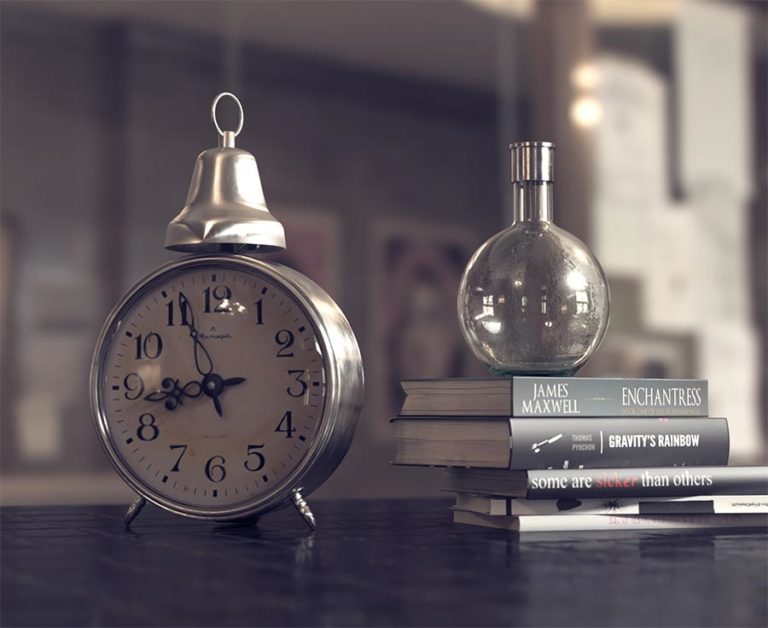
Locate an element on the screen. Image resolution: width=768 pixels, height=628 pixels. gray wall is located at coordinates (398, 143), (398, 343).